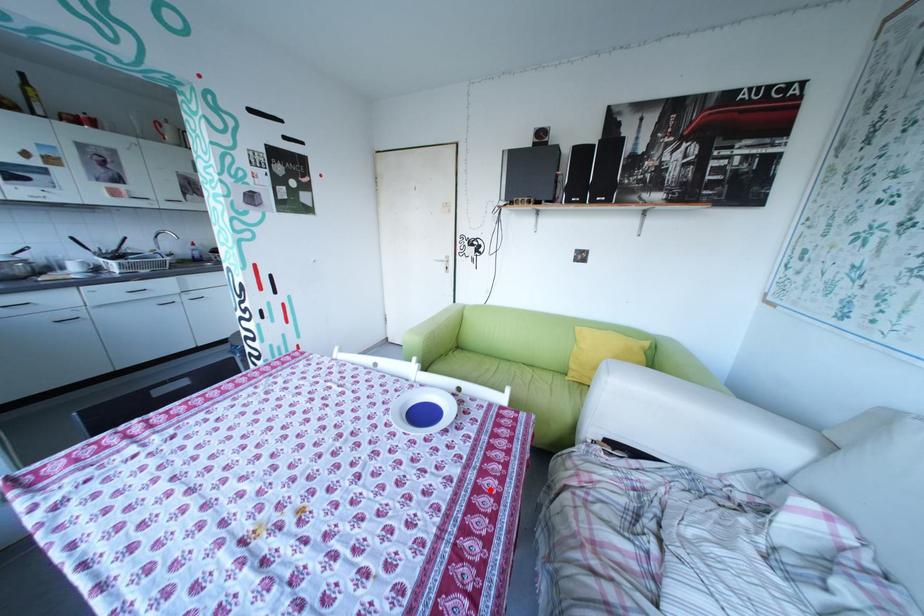
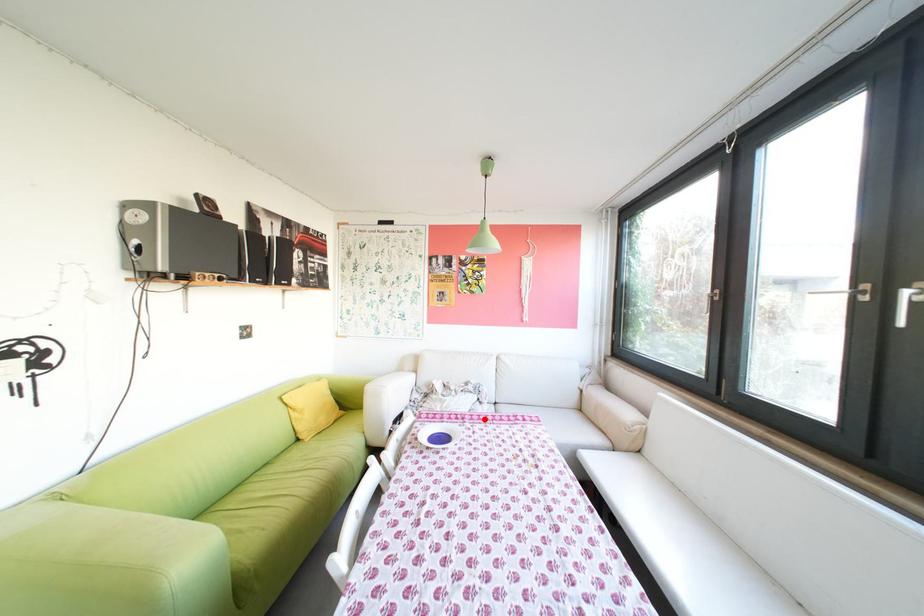
I am providing you with two images of the same scene from different viewpoints. A red point is marked on the first image and another point is marked on the second image. Are the points marked in image1 and image2 representing the same 3D position?

Yes